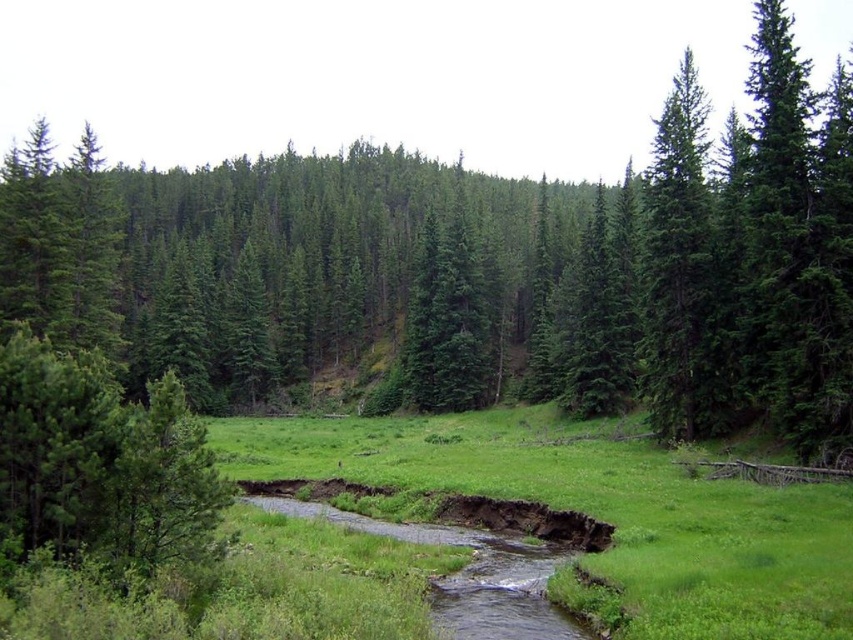
You are a hiker standing in the middle of the green grassy field at center. You want to reach the top of the green matte tree at center. Is it possible to climb the tree from the current position?

The green matte tree at center is much taller than the green grassy field at center, so yes, you can climb the tree from your current position as the tree is elevated above the field.

You are a hiker standing at the edge of the green grassy field at center and want to reach the green matte tree at right. Which direction should you move to get closer to the tree?

The green matte tree at right is taller than the green grassy field at center, so you should move towards the right direction to get closer to the green matte tree at right.